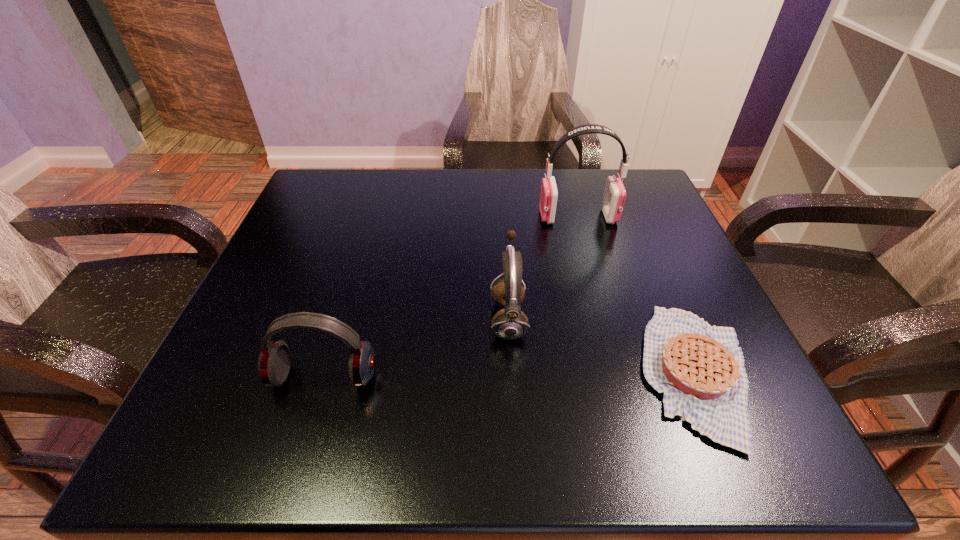
Where is `free space located on the ear pads of the third shortest object`? Image resolution: width=960 pixels, height=540 pixels. free space located on the ear pads of the third shortest object is located at coordinates (462, 318).

What are the coordinates of `vacant space located 0.290m on the ear pads of the third shortest object` in the screenshot? It's located at (324, 318).

Identify the location of free space located 0.390m on the ear pads of the third shortest object. (267, 318).

Find the location of a particular element. This screenshot has height=540, width=960. vacant space located 0.090m on the ear cups of the leftmost object is located at coordinates (300, 455).

Identify the location of free space located on the back of the pie. The image size is (960, 540). (644, 248).

Image resolution: width=960 pixels, height=540 pixels. Identify the location of object that is at the far edge. (614, 195).

This screenshot has width=960, height=540. In order to click on object located in the near edge section of the desktop in this screenshot , I will do `click(700, 369)`.

You are a GUI agent. You are given a task and a screenshot of the screen. Output one action in this format:
    pyautogui.click(x=<x>, y=<y>)
    Task: Click on the object at the left edge
    
    Given the screenshot: What is the action you would take?
    273,365

The width and height of the screenshot is (960, 540). Find the location of `earphone at the right edge`. earphone at the right edge is located at coordinates (614, 195).

The height and width of the screenshot is (540, 960). Identify the location of pie situated at the right edge. tap(700, 369).